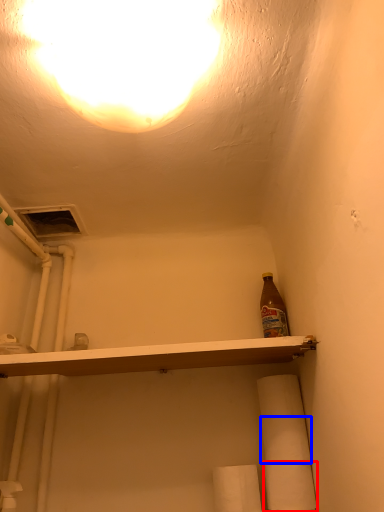
Question: Among these objects, which one is nearest to the camera, toilet paper (highlighted by a red box) or toilet paper (highlighted by a blue box)?

Choices:
 (A) toilet paper
 (B) toilet paper

Answer: (A)